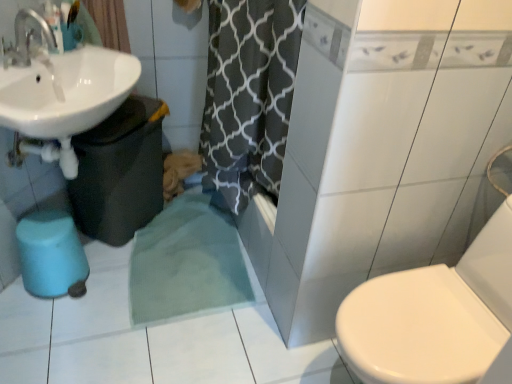
Question: Considering the relative sizes of blue rubber bidet at lower left and white glossy sink at upper left in the image provided, is blue rubber bidet at lower left thinner than white glossy sink at upper left?

Choices:
 (A) yes
 (B) no

Answer: (A)

Question: Considering the relative sizes of blue rubber bidet at lower left and white glossy sink at upper left in the image provided, is blue rubber bidet at lower left taller than white glossy sink at upper left?

Choices:
 (A) no
 (B) yes

Answer: (A)

Question: Is blue rubber bidet at lower left in front of white glossy sink at upper left?

Choices:
 (A) yes
 (B) no

Answer: (B)

Question: Is blue rubber bidet at lower left wider than white glossy sink at upper left?

Choices:
 (A) yes
 (B) no

Answer: (B)

Question: Does blue rubber bidet at lower left appear on the left side of white glossy sink at upper left?

Choices:
 (A) no
 (B) yes

Answer: (B)

Question: Is the depth of blue rubber bidet at lower left greater than that of white glossy sink at upper left?

Choices:
 (A) yes
 (B) no

Answer: (A)

Question: Is white glossy sink at upper left wider than blue rubber bidet at lower left?

Choices:
 (A) no
 (B) yes

Answer: (B)

Question: From a real-world perspective, does white glossy sink at upper left stand above blue rubber bidet at lower left?

Choices:
 (A) no
 (B) yes

Answer: (B)

Question: Is white glossy sink at upper left aimed at blue rubber bidet at lower left?

Choices:
 (A) no
 (B) yes

Answer: (A)

Question: Is white glossy sink at upper left positioned behind blue rubber bidet at lower left?

Choices:
 (A) yes
 (B) no

Answer: (B)

Question: Can you confirm if white glossy sink at upper left is shorter than blue rubber bidet at lower left?

Choices:
 (A) yes
 (B) no

Answer: (B)

Question: Can you confirm if white glossy sink at upper left is thinner than blue rubber bidet at lower left?

Choices:
 (A) no
 (B) yes

Answer: (A)

Question: From a real-world perspective, is white glossy sink at upper left located higher than cotton curtain at upper left?

Choices:
 (A) no
 (B) yes

Answer: (A)